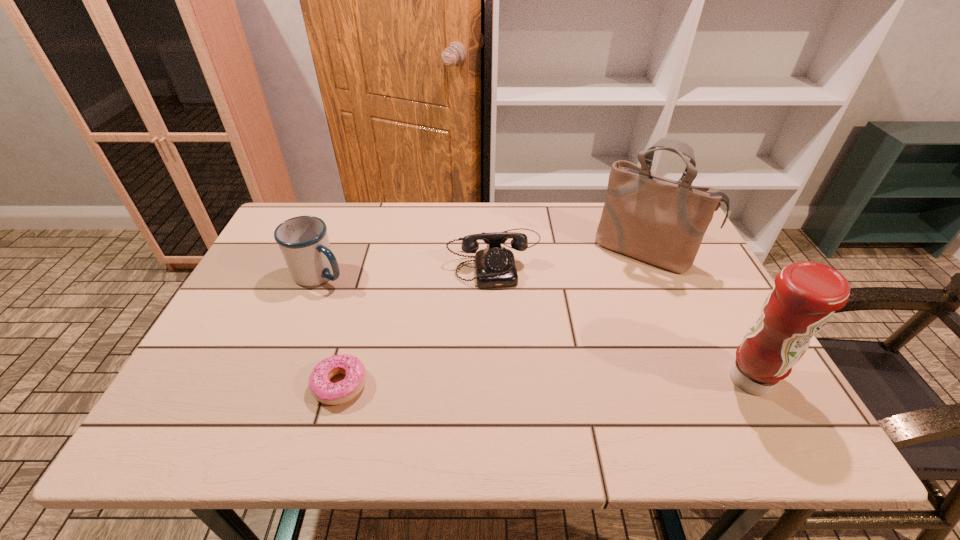
Find the location of a particular element. The image size is (960, 540). vacant point at the left edge is located at coordinates (251, 284).

The height and width of the screenshot is (540, 960). Find the location of `vacant space at the right edge of the desktop`. vacant space at the right edge of the desktop is located at coordinates (702, 257).

This screenshot has width=960, height=540. I want to click on vacant space at the near left corner, so click(228, 393).

Where is `blank region between the second tallest object and the tallest object`? This screenshot has width=960, height=540. blank region between the second tallest object and the tallest object is located at coordinates (698, 315).

The image size is (960, 540). I want to click on vacant space that's between the condiment and the shortest object, so click(545, 382).

Identify the location of free area in between the shoulder bag and the doughnut. (492, 318).

Find the location of a particular element. Image resolution: width=960 pixels, height=540 pixels. unoccupied area between the leftmost object and the third object from left to right is located at coordinates (x=408, y=266).

Find the location of a particular element. Image resolution: width=960 pixels, height=540 pixels. empty location between the telephone and the second object from left to right is located at coordinates (418, 321).

Identify the location of vacant point located between the shortest object and the telephone. (418, 321).

Find the location of a particular element. blank region between the leftmost object and the fourth tallest object is located at coordinates (408, 266).